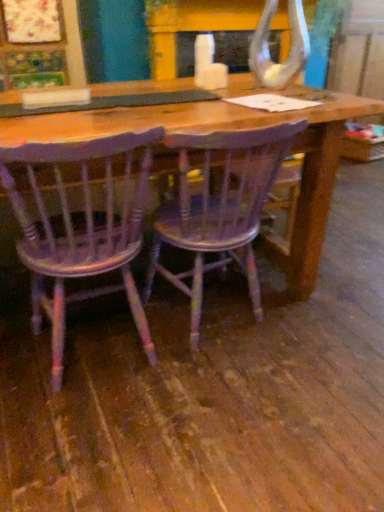
Question: Does wooden chair at center, the 1th chair when ordered from right to left, lie in front of distressed purple wood chair at center, acting as the first chair starting from the left?

Choices:
 (A) no
 (B) yes

Answer: (A)

Question: Is wooden chair at center, the 1th chair when ordered from right to left, at the right side of distressed purple wood chair at center, positioned as the 2th chair in right-to-left order?

Choices:
 (A) no
 (B) yes

Answer: (B)

Question: Can you confirm if wooden chair at center, the 1th chair when ordered from right to left, is positioned to the left of distressed purple wood chair at center, acting as the first chair starting from the left?

Choices:
 (A) no
 (B) yes

Answer: (A)

Question: From a real-world perspective, is wooden chair at center, the second chair from the left, beneath distressed purple wood chair at center, positioned as the 2th chair in right-to-left order?

Choices:
 (A) yes
 (B) no

Answer: (A)

Question: Is wooden chair at center, the 1th chair when ordered from right to left, surrounding distressed purple wood chair at center, positioned as the 2th chair in right-to-left order?

Choices:
 (A) yes
 (B) no

Answer: (B)

Question: Can you confirm if wooden chair at center, the 1th chair when ordered from right to left, is thinner than distressed purple wood chair at center, positioned as the 2th chair in right-to-left order?

Choices:
 (A) no
 (B) yes

Answer: (A)

Question: Can you confirm if distressed purple wood chair at center, acting as the first chair starting from the left, is bigger than wooden chair at center, the 1th chair when ordered from right to left?

Choices:
 (A) no
 (B) yes

Answer: (A)

Question: Is distressed purple wood chair at center, acting as the first chair starting from the left, far from wooden chair at center, the 1th chair when ordered from right to left?

Choices:
 (A) yes
 (B) no

Answer: (B)

Question: From a real-world perspective, is distressed purple wood chair at center, acting as the first chair starting from the left, positioned over wooden chair at center, the 1th chair when ordered from right to left, based on gravity?

Choices:
 (A) no
 (B) yes

Answer: (B)

Question: Is distressed purple wood chair at center, positioned as the 2th chair in right-to-left order, closer to the viewer compared to wooden chair at center, the second chair from the left?

Choices:
 (A) no
 (B) yes

Answer: (B)

Question: Does distressed purple wood chair at center, acting as the first chair starting from the left, have a smaller size compared to wooden chair at center, the second chair from the left?

Choices:
 (A) no
 (B) yes

Answer: (B)

Question: From the image's perspective, is distressed purple wood chair at center, positioned as the 2th chair in right-to-left order, beneath wooden chair at center, the second chair from the left?

Choices:
 (A) yes
 (B) no

Answer: (A)

Question: Considering the relative positions of distressed purple wood chair at center, acting as the first chair starting from the left, and wooden chair at center, the second chair from the left, in the image provided, is distressed purple wood chair at center, acting as the first chair starting from the left, to the left or to the right of wooden chair at center, the second chair from the left,?

Choices:
 (A) left
 (B) right

Answer: (A)